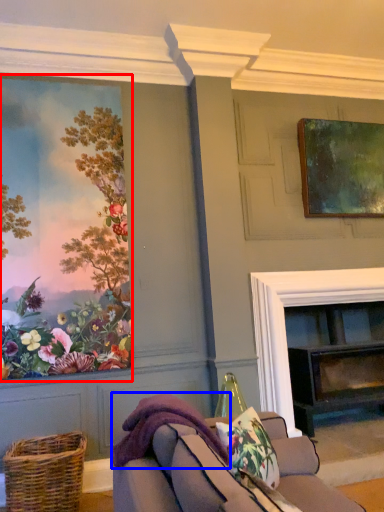
Question: Which object is closer to the camera taking this photo, picture frame (highlighted by a red box) or blanket (highlighted by a blue box)?

Choices:
 (A) picture frame
 (B) blanket

Answer: (B)